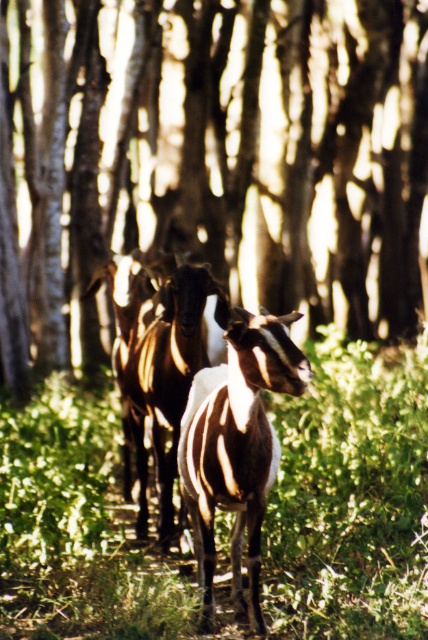
Question: Can you confirm if brown wood tree at center is thinner than brown textured goat at center?

Choices:
 (A) yes
 (B) no

Answer: (B)

Question: Which is farther from the brown wood tree at center?

Choices:
 (A) green leafy grass at center
 (B) brown textured goat at center

Answer: (B)

Question: Which point is farther from the camera taking this photo?

Choices:
 (A) (149, 316)
 (B) (365, 150)
 (C) (213, 394)

Answer: (B)

Question: Is green leafy grass at center to the right of white and brown fur goat at center from the viewer's perspective?

Choices:
 (A) no
 (B) yes

Answer: (A)

Question: Is green leafy grass at center bigger than brown textured goat at center?

Choices:
 (A) yes
 (B) no

Answer: (A)

Question: Which object appears farthest from the camera in this image?

Choices:
 (A) brown wood tree at center
 (B) green leafy grass at center
 (C) white and brown fur goat at center

Answer: (A)